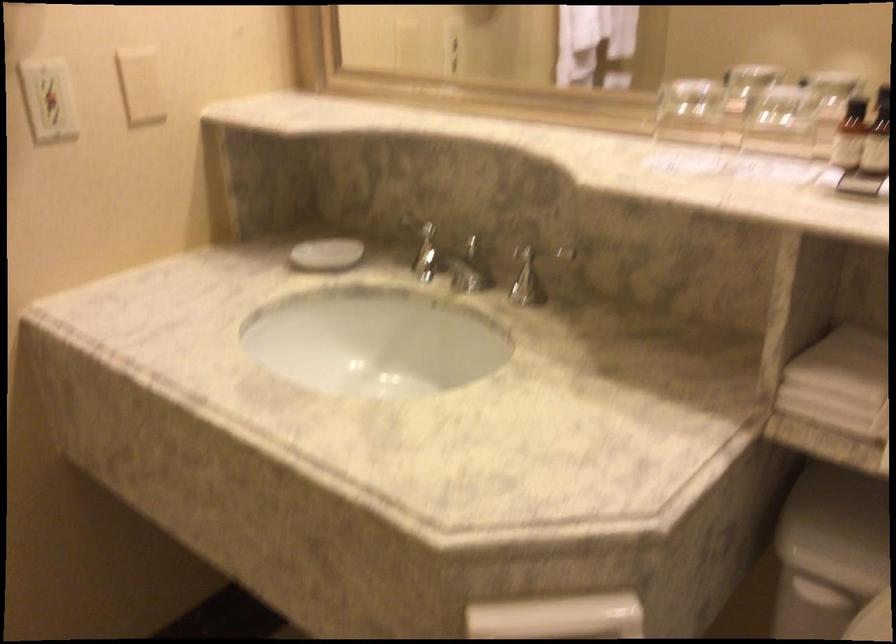
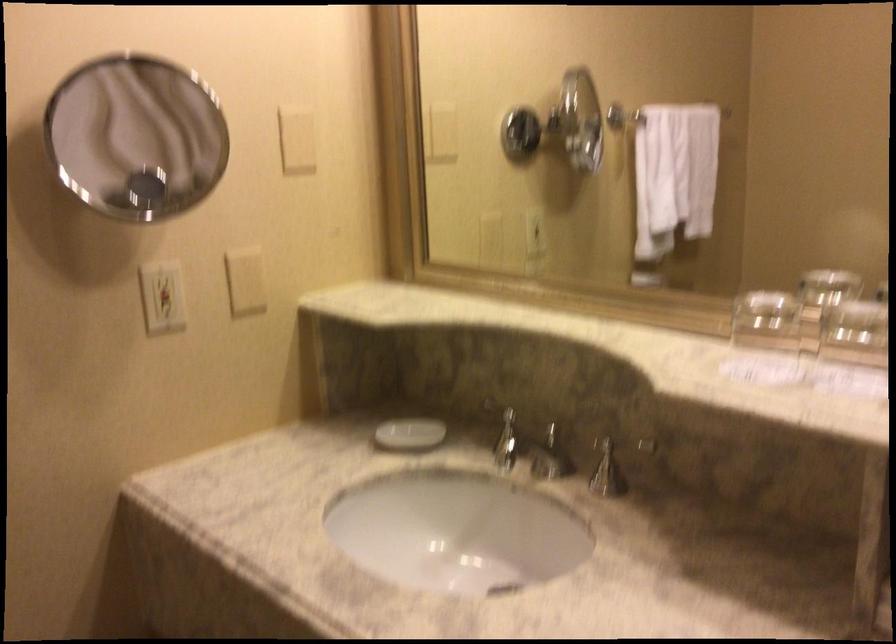
Question: The images are taken continuously from a first-person perspective. In which direction is your viewpoint rotating?

Choices:
 (A) Left
 (B) Right
 (C) Up
 (D) Down

Answer: (C)